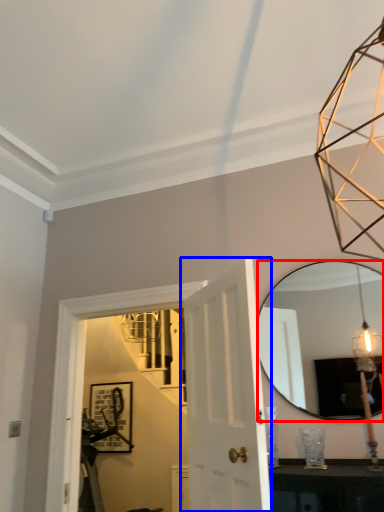
Question: Which point is further to the camera, mirror (highlighted by a red box) or door (highlighted by a blue box)?

Choices:
 (A) mirror
 (B) door

Answer: (A)